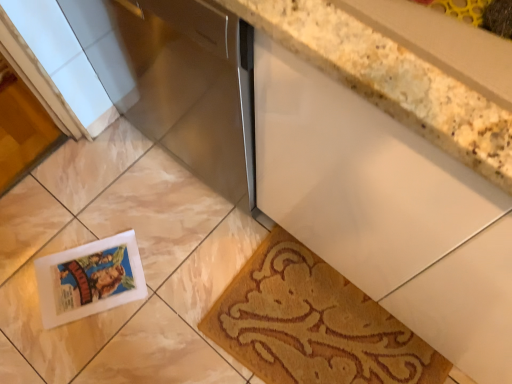
Locate an element on the screen. vacant point above brown textured mat at lower right (from a real-world perspective) is located at coordinates (312, 321).